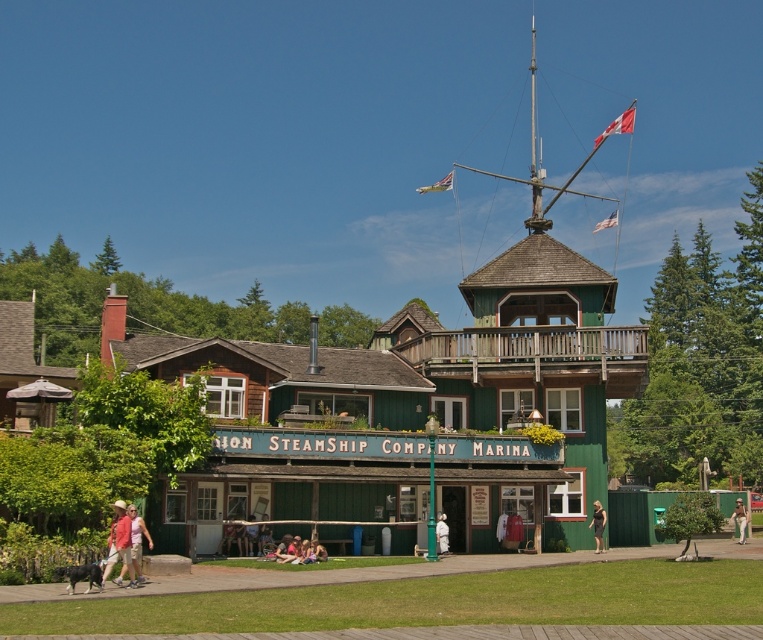
Can you confirm if matte red shirt at lower left is positioned below dark gray fabric dress at center?

No.

Between point (126, 547) and point (604, 509), which one is positioned in front?

Point (126, 547) is more forward.

Describe the element at coordinates (118, 541) in the screenshot. I see `matte red shirt at lower left` at that location.

Identify the location of matte red shirt at lower left. (118, 541).

Is dark gray fabric dress at center thinner than white cotton dress at center?

Incorrect, dark gray fabric dress at center's width is not less than white cotton dress at center's.

Is dark gray fabric dress at center closer to the viewer compared to white cotton dress at center?

No.

What do you see at coordinates (597, 525) in the screenshot? This screenshot has height=640, width=763. I see `dark gray fabric dress at center` at bounding box center [597, 525].

Where is `dark gray fabric dress at center`? dark gray fabric dress at center is located at coordinates (597, 525).

Based on the photo, is dark gray fabric dress at center closer to camera compared to white cotton shirt at center?

Yes, dark gray fabric dress at center is closer to the viewer.

Does dark gray fabric dress at center have a larger size compared to white cotton shirt at center?

Yes, dark gray fabric dress at center is bigger than white cotton shirt at center.

You are a GUI agent. You are given a task and a screenshot of the screen. Output one action in this format:
    pyautogui.click(x=<x>, y=<y>)
    Task: Click on the dark gray fabric dress at center
    The height and width of the screenshot is (640, 763).
    Given the screenshot: What is the action you would take?
    pyautogui.click(x=597, y=525)

At what (x,y) coordinates should I click in order to perform the action: click on dark gray fabric dress at center. Please return your answer as a coordinate pair (x, y). Image resolution: width=763 pixels, height=640 pixels. Looking at the image, I should click on (597, 525).